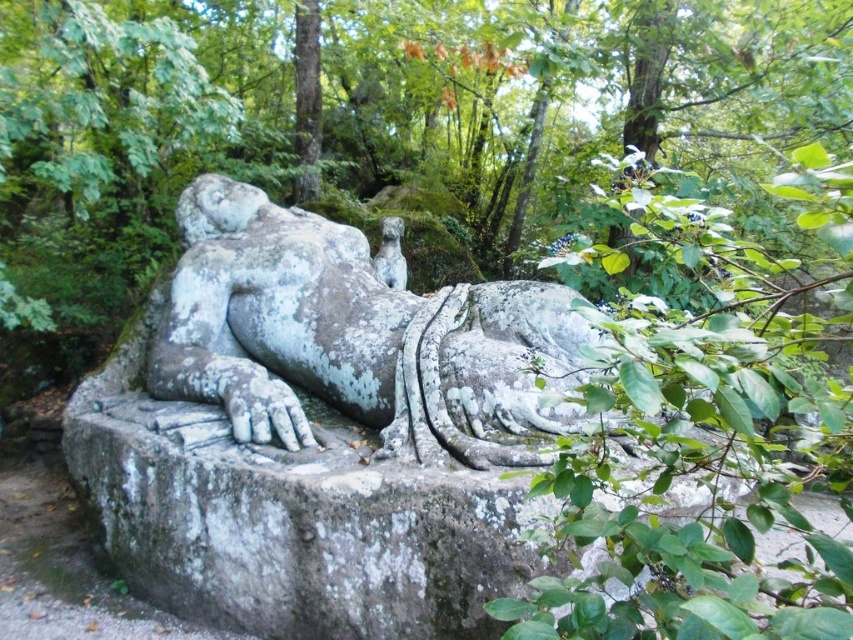
You are standing in front of the large stone sculpture and want to take a photo. You notice two points on the sculpture labeled as point (300,282) and point (396,241). Which point should you focus on if you want to capture the part of the sculpture that is closer to you?

You should focus on point (300,282) because it is closer to the camera than point (396,241).

Consider the image. You are an art student observing the gray stone statue at center and the smooth gray stone face at center. Which part of the statue is more prominent to your view?

The gray stone statue at center is closer to the viewer than the smooth gray stone face at center, so the gray stone statue at center is more prominent in view.